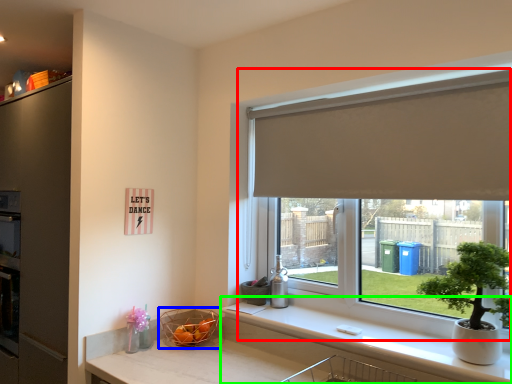
Question: Estimate the real-world distances between objects in this image. Which object is closer to window (highlighted by a red box), basket (highlighted by a blue box) or counter top (highlighted by a green box)?

Choices:
 (A) basket
 (B) counter top

Answer: (B)